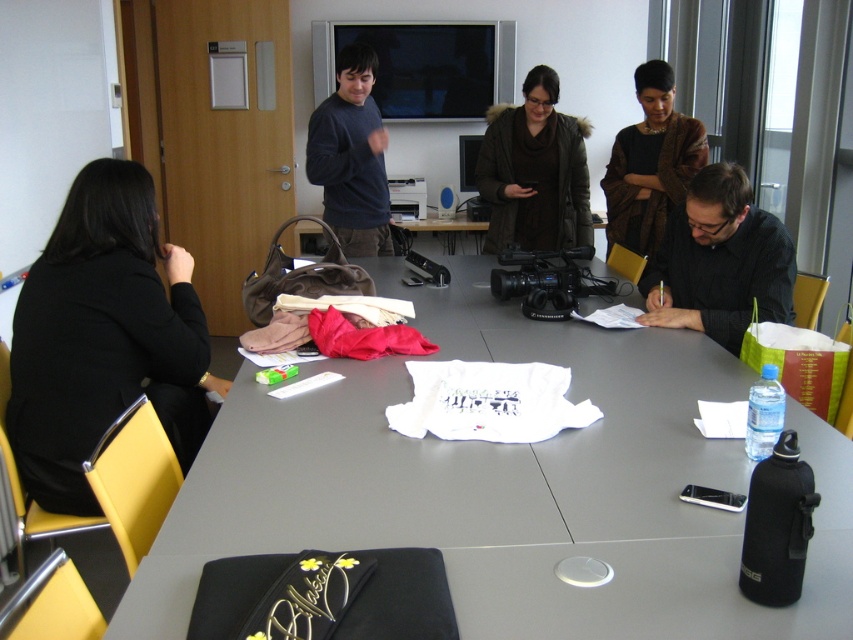
You are a photographer positioned at the back of the conference room. You want to take a clear photo of the white fabric shirt at center and the brown textured coat at upper center. Which object will appear larger in your photo?

The white fabric shirt at center will appear larger in the photo because it is closer to the viewer than the brown textured coat at upper center.

You are a delivery person who needs to place a package between the brown fuzzy coat at center and the dark blue sweater at upper center. The package is 24 inches long. Can you fit it between them without moving either object?

The distance between the brown fuzzy coat at center and the dark blue sweater at upper center is 25.80 inches. Since the package is 24 inches long, it can fit between them as there is enough space.